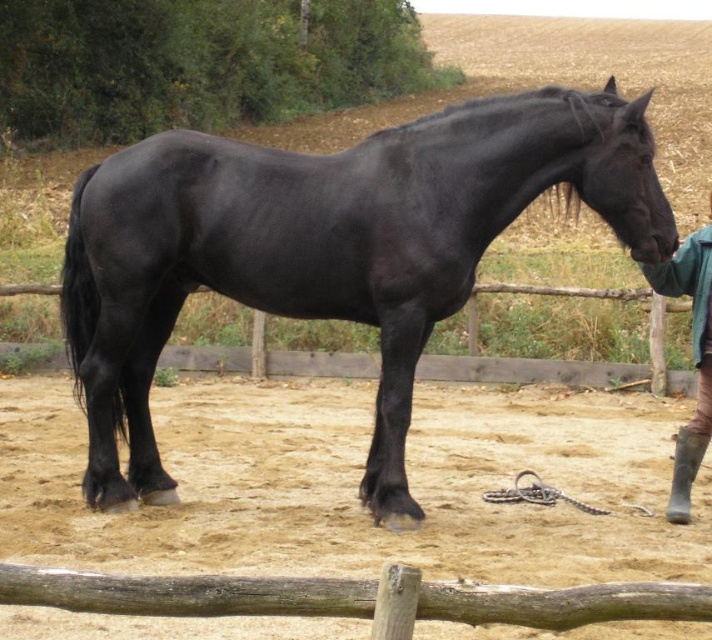
Question: Is black glossy horse at center thinner than green fabric jacket at lower right?

Choices:
 (A) yes
 (B) no

Answer: (B)

Question: Considering the relative positions of wooden fence at center and green fabric jacket at lower right in the image provided, where is wooden fence at center located with respect to green fabric jacket at lower right?

Choices:
 (A) left
 (B) right

Answer: (A)

Question: Which object appears farthest from the camera in this image?

Choices:
 (A) black glossy horse at center
 (B) green fabric jacket at lower right

Answer: (B)

Question: Which object is the closest to the wooden fence at center?

Choices:
 (A) green fabric jacket at lower right
 (B) black glossy horse at center

Answer: (A)

Question: Is wooden fence at center above green fabric jacket at lower right?

Choices:
 (A) yes
 (B) no

Answer: (A)

Question: Which is farther from the black glossy horse at center?

Choices:
 (A) green fabric jacket at lower right
 (B) wooden fence at center

Answer: (B)